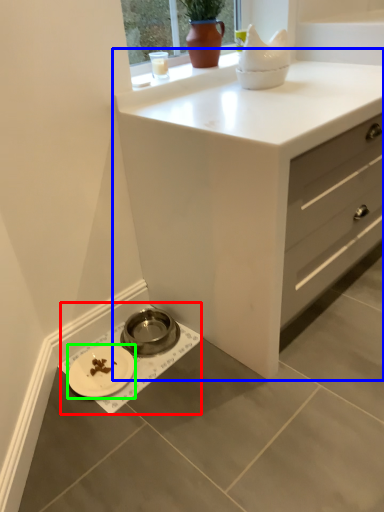
Question: Which object is positioned closest to sink (highlighted by a red box)? Select from chest of drawers (highlighted by a blue box) and platter (highlighted by a green box).

Choices:
 (A) chest of drawers
 (B) platter

Answer: (B)